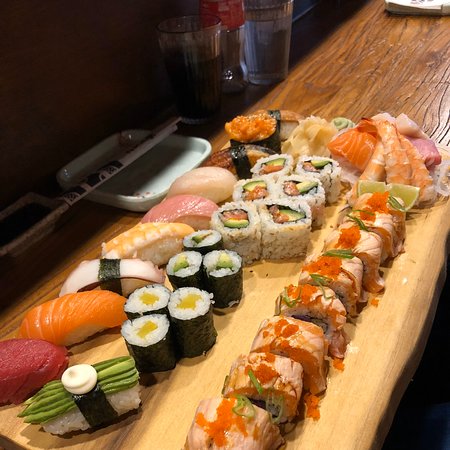
Image resolution: width=450 pixels, height=450 pixels. In order to click on chopsticks in wrapper in this screenshot , I will do `click(75, 196)`.